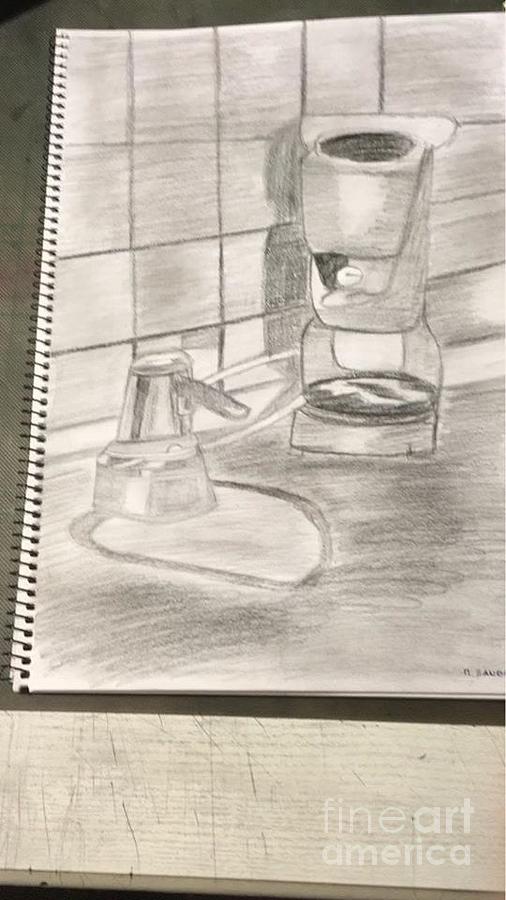
Locate an element on the screen. This screenshot has width=506, height=900. coffee maker is located at coordinates (348, 321).